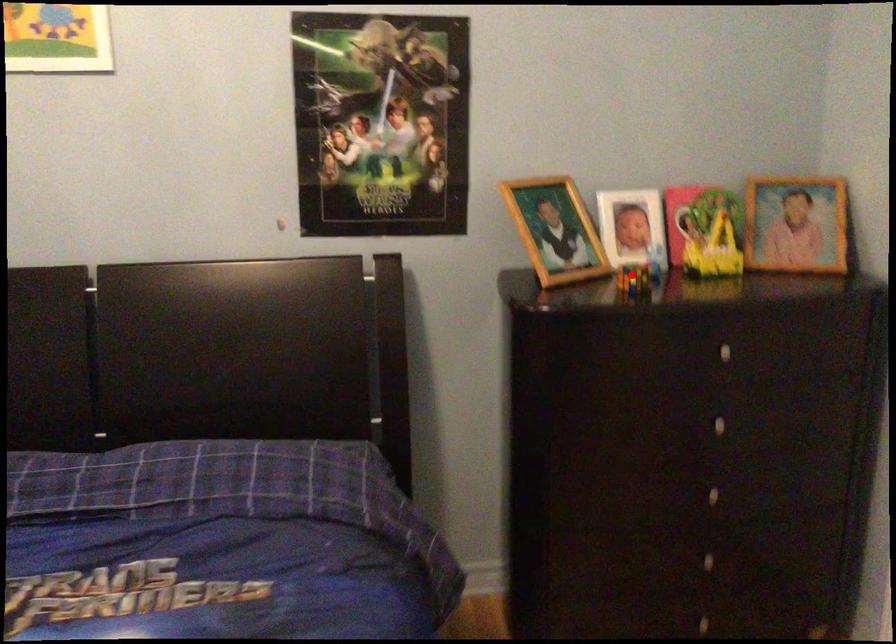
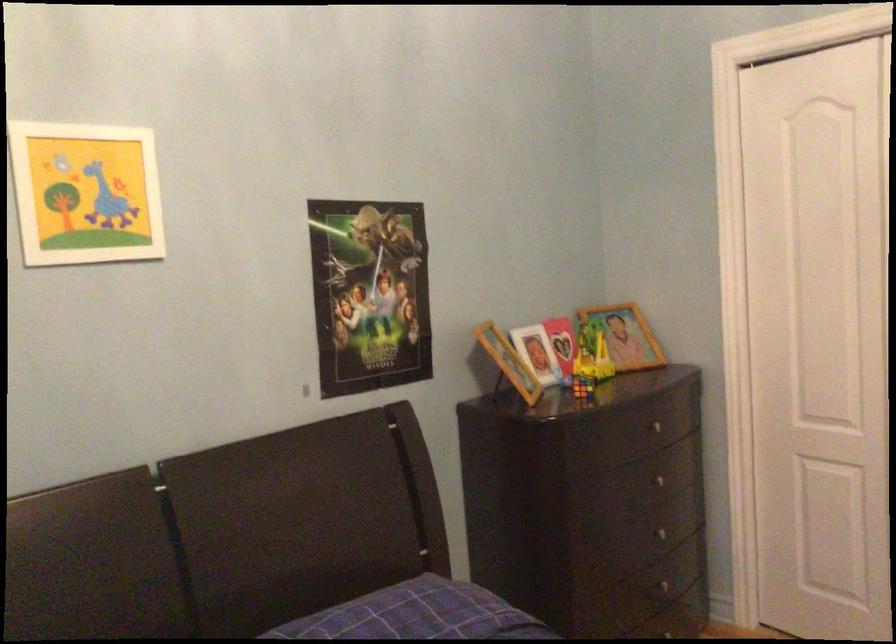
Question: I am providing you with two images of the same scene from different viewpoints. Given a red point in image1, look at the same physical point in image2. Is it:

Choices:
 (A) Closer to the viewpoint
 (B) Farther from the viewpoint

Answer: (B)